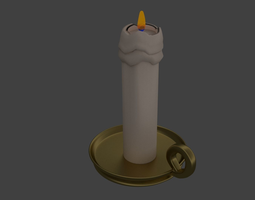
Locate an element on the screen. melted candle wick is located at coordinates (128, 54), (152, 53), (132, 65), (153, 64).